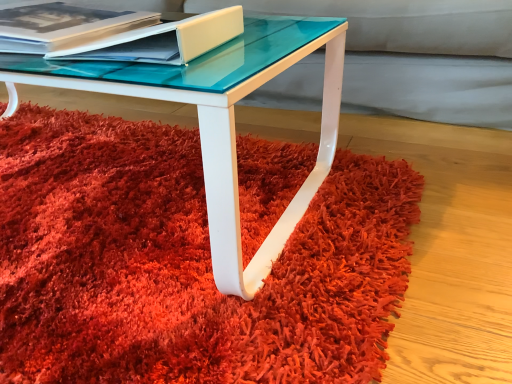
Question: Can you confirm if matte white book at upper left, which ranks as the second paperback book in right-to-left order, is bigger than matte white book at upper left, marked as the first paperback book in a right-to-left arrangement?

Choices:
 (A) no
 (B) yes

Answer: (B)

Question: Could you tell me if matte white book at upper left, the 1th paperback book viewed from the left, is facing matte white book at upper left, the second paperback book positioned from the left?

Choices:
 (A) yes
 (B) no

Answer: (B)

Question: Is matte white book at upper left, the 1th paperback book viewed from the left, smaller than matte white book at upper left, the second paperback book positioned from the left?

Choices:
 (A) no
 (B) yes

Answer: (A)

Question: Is matte white book at upper left, the 1th paperback book viewed from the left, facing away from matte white book at upper left, the second paperback book positioned from the left?

Choices:
 (A) no
 (B) yes

Answer: (A)

Question: Is matte white book at upper left, the 1th paperback book viewed from the left, with matte white book at upper left, the second paperback book positioned from the left?

Choices:
 (A) yes
 (B) no

Answer: (B)

Question: From the image's perspective, is shaggy red carpet at lower center located above or below matte white book at upper left, the second paperback book positioned from the left?

Choices:
 (A) above
 (B) below

Answer: (B)

Question: Based on their sizes in the image, would you say shaggy red carpet at lower center is bigger or smaller than matte white book at upper left, the second paperback book positioned from the left?

Choices:
 (A) small
 (B) big

Answer: (B)

Question: Looking at their shapes, would you say shaggy red carpet at lower center is wider or thinner than matte white book at upper left, the second paperback book positioned from the left?

Choices:
 (A) wide
 (B) thin

Answer: (A)

Question: From a real-world perspective, is shaggy red carpet at lower center above or below matte white book at upper left, the second paperback book positioned from the left?

Choices:
 (A) below
 (B) above

Answer: (A)

Question: Is matte white book at upper left, which ranks as the second paperback book in right-to-left order, bigger or smaller than matte white book at upper left, marked as the first paperback book in a right-to-left arrangement?

Choices:
 (A) small
 (B) big

Answer: (B)

Question: In the image, is matte white book at upper left, which ranks as the second paperback book in right-to-left order, positioned in front of or behind matte white book at upper left, the second paperback book positioned from the left?

Choices:
 (A) front
 (B) behind

Answer: (B)

Question: Considering the positions of matte white book at upper left, which ranks as the second paperback book in right-to-left order, and matte white book at upper left, the second paperback book positioned from the left, in the image, is matte white book at upper left, which ranks as the second paperback book in right-to-left order, taller or shorter than matte white book at upper left, the second paperback book positioned from the left,?

Choices:
 (A) short
 (B) tall

Answer: (B)

Question: From a real-world perspective, relative to matte white book at upper left, marked as the first paperback book in a right-to-left arrangement, is matte white book at upper left, which ranks as the second paperback book in right-to-left order, vertically above or below?

Choices:
 (A) below
 (B) above

Answer: (A)

Question: Considering the positions of matte white book at upper left, the second paperback book positioned from the left, and matte white book at upper left, which ranks as the second paperback book in right-to-left order, in the image, is matte white book at upper left, the second paperback book positioned from the left, taller or shorter than matte white book at upper left, which ranks as the second paperback book in right-to-left order,?

Choices:
 (A) tall
 (B) short

Answer: (B)

Question: Would you say matte white book at upper left, marked as the first paperback book in a right-to-left arrangement, is to the left or to the right of matte white book at upper left, which ranks as the second paperback book in right-to-left order, in the picture?

Choices:
 (A) right
 (B) left

Answer: (A)